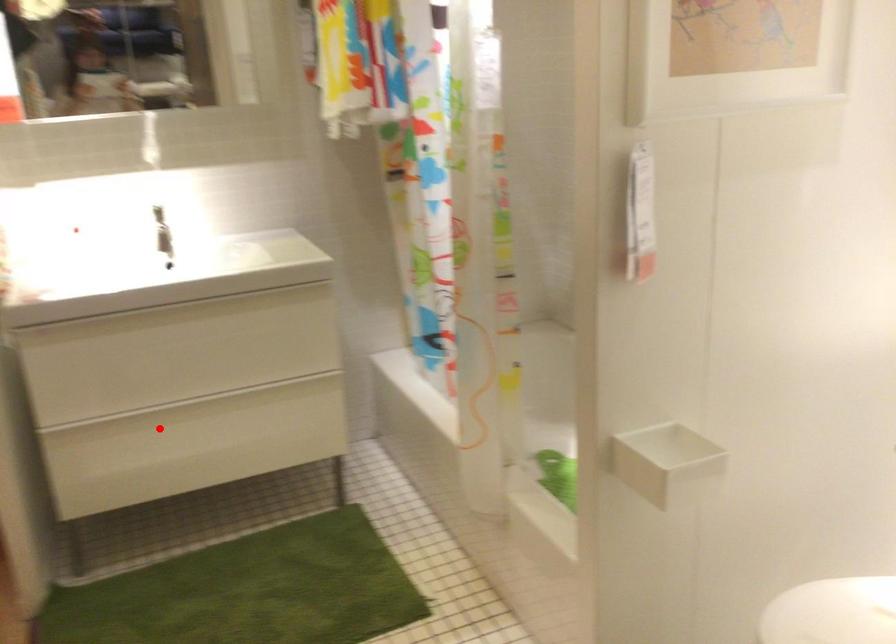
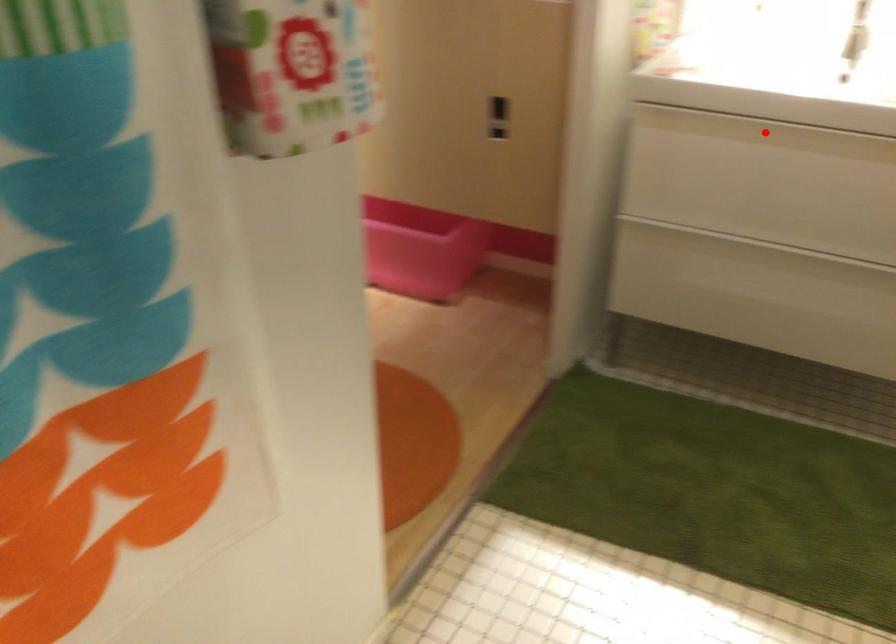
I am providing you with two images of the same scene from different viewpoints. A red point is marked on the first image and another point is marked on the second image. Does the point marked in image1 correspond to the same location as the one in image2?

No